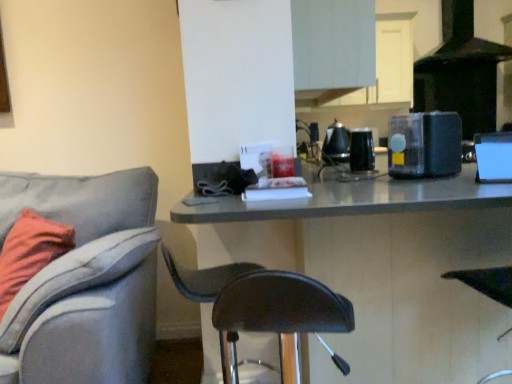
What is the approximate width of black matte exhaust hood at upper right?

black matte exhaust hood at upper right is 53.10 centimeters in width.

Where is `black plastic blender at upper right, which appears as the 2th appliance when viewed from the front`? black plastic blender at upper right, which appears as the 2th appliance when viewed from the front is located at coordinates (424, 145).

From a real-world perspective, is black matte exhaust hood at upper right on black glossy coffee maker at upper center, which ranks as the third appliance in front-to-back order?

Yes, from a real-world perspective, black matte exhaust hood at upper right is over black glossy coffee maker at upper center, which ranks as the third appliance in front-to-back order

Based on their sizes in the image, would you say black matte exhaust hood at upper right is bigger or smaller than black glossy coffee maker at upper center, marked as the 2th appliance in a back-to-front arrangement?

Considering their sizes, black matte exhaust hood at upper right takes up more space than black glossy coffee maker at upper center, marked as the 2th appliance in a back-to-front arrangement.

From the image's perspective, is black matte exhaust hood at upper right located above or below black glossy coffee maker at upper center, which ranks as the third appliance in front-to-back order?

black matte exhaust hood at upper right is above black glossy coffee maker at upper center, which ranks as the third appliance in front-to-back order.

Considering the sizes of objects black matte exhaust hood at upper right and black glossy coffee maker at upper center, marked as the 2th appliance in a back-to-front arrangement, in the image provided, who is thinner, black matte exhaust hood at upper right or black glossy coffee maker at upper center, marked as the 2th appliance in a back-to-front arrangement,?

With smaller width is black glossy coffee maker at upper center, marked as the 2th appliance in a back-to-front arrangement.

From a real-world perspective, between light gray fabric chair at left, arranged as the second chair when viewed from the right, and black glossy kettle at upper center, marked as the 1th appliance in a back-to-front arrangement, who is vertically higher?

black glossy kettle at upper center, marked as the 1th appliance in a back-to-front arrangement.

How different are the orientations of light gray fabric chair at left, which ranks as the 1th chair in left-to-right order, and black glossy kettle at upper center, marked as the 1th appliance in a back-to-front arrangement, in degrees?

light gray fabric chair at left, which ranks as the 1th chair in left-to-right order, and black glossy kettle at upper center, marked as the 1th appliance in a back-to-front arrangement, are facing 86.2 degrees away from each other.

From the image's perspective, is light gray fabric chair at left, which ranks as the 1th chair in left-to-right order, above black glossy kettle at upper center, which is the fourth appliance in front-to-back order?

Incorrect, from the image's perspective, light gray fabric chair at left, which ranks as the 1th chair in left-to-right order, is lower than black glossy kettle at upper center, which is the fourth appliance in front-to-back order.

Considering the sizes of light gray fabric chair at left, which ranks as the 1th chair in left-to-right order, and black glossy kettle at upper center, which is the fourth appliance in front-to-back order, in the image, is light gray fabric chair at left, which ranks as the 1th chair in left-to-right order, wider or thinner than black glossy kettle at upper center, which is the fourth appliance in front-to-back order,?

light gray fabric chair at left, which ranks as the 1th chair in left-to-right order, is wider than black glossy kettle at upper center, which is the fourth appliance in front-to-back order.

Could you tell me if black glossy kettle at upper center, which is the fourth appliance in front-to-back order, is facing black leather chair at center, placed as the second chair when sorted from left to right?

No, black glossy kettle at upper center, which is the fourth appliance in front-to-back order, does not turn towards black leather chair at center, placed as the second chair when sorted from left to right.

Looking at the image, does black glossy kettle at upper center, marked as the 1th appliance in a back-to-front arrangement, seem bigger or smaller compared to black leather chair at center, placed as the second chair when sorted from left to right?

black glossy kettle at upper center, marked as the 1th appliance in a back-to-front arrangement, is smaller than black leather chair at center, placed as the second chair when sorted from left to right.

From the picture: Which point is more forward, (345, 133) or (281, 349)?

The point (281, 349) is in front.

Between black plastic blender at upper right, which appears as the 2th appliance when viewed from the front, and black glossy coffee maker at upper center, which ranks as the third appliance in front-to-back order, which one appears on the left side from the viewer's perspective?

black glossy coffee maker at upper center, which ranks as the third appliance in front-to-back order, is more to the left.

From a real-world perspective, relative to black glossy coffee maker at upper center, marked as the 2th appliance in a back-to-front arrangement, is black plastic blender at upper right, which appears as the 3th appliance when viewed from the back, vertically above or below?

In terms of real-world spatial position, black plastic blender at upper right, which appears as the 3th appliance when viewed from the back, is above black glossy coffee maker at upper center, marked as the 2th appliance in a back-to-front arrangement.

From their relative heights in the image, would you say black plastic blender at upper right, which appears as the 2th appliance when viewed from the front, is taller or shorter than black glossy coffee maker at upper center, which ranks as the third appliance in front-to-back order?

Considering their sizes, black plastic blender at upper right, which appears as the 2th appliance when viewed from the front, has more height than black glossy coffee maker at upper center, which ranks as the third appliance in front-to-back order.

Is point (115, 312) closer or farther from the camera than point (298, 301)?

Point (115, 312) is farther from the camera than point (298, 301).

Considering the relative sizes of light gray fabric chair at left, arranged as the second chair when viewed from the right, and black leather chair at center, marked as the 1th chair in a right-to-left arrangement, in the image provided, is light gray fabric chair at left, arranged as the second chair when viewed from the right, shorter than black leather chair at center, marked as the 1th chair in a right-to-left arrangement,?

In fact, light gray fabric chair at left, arranged as the second chair when viewed from the right, may be taller than black leather chair at center, marked as the 1th chair in a right-to-left arrangement.

Find the location of a particular element. This screenshot has height=384, width=512. chair in front of the black leather chair at center, placed as the second chair when sorted from left to right is located at coordinates (86, 279).

Is light gray fabric chair at left, arranged as the second chair when viewed from the right, aimed at black leather chair at center, placed as the second chair when sorted from left to right?

No, light gray fabric chair at left, arranged as the second chair when viewed from the right, is not turned towards black leather chair at center, placed as the second chair when sorted from left to right.

From a real-world perspective, is light gray fabric chair at left, which ranks as the 1th chair in left-to-right order, physically below black plastic blender at upper right, which appears as the 3th appliance when viewed from the back?

Yes, from a real-world perspective, light gray fabric chair at left, which ranks as the 1th chair in left-to-right order, is beneath black plastic blender at upper right, which appears as the 3th appliance when viewed from the back.

Considering the relative sizes of light gray fabric chair at left, which ranks as the 1th chair in left-to-right order, and black plastic blender at upper right, which appears as the 3th appliance when viewed from the back, in the image provided, is light gray fabric chair at left, which ranks as the 1th chair in left-to-right order, shorter than black plastic blender at upper right, which appears as the 3th appliance when viewed from the back,?

No, light gray fabric chair at left, which ranks as the 1th chair in left-to-right order, is not shorter than black plastic blender at upper right, which appears as the 3th appliance when viewed from the back.

Considering the positions of objects light gray fabric chair at left, which ranks as the 1th chair in left-to-right order, and black plastic blender at upper right, which appears as the 2th appliance when viewed from the front, in the image provided, who is behind, light gray fabric chair at left, which ranks as the 1th chair in left-to-right order, or black plastic blender at upper right, which appears as the 2th appliance when viewed from the front,?

black plastic blender at upper right, which appears as the 2th appliance when viewed from the front, is more distant.

From the image's perspective, relative to black plastic blender at upper right, which appears as the 2th appliance when viewed from the front, is light gray fabric chair at left, which ranks as the 1th chair in left-to-right order, above or below?

From the image's perspective, light gray fabric chair at left, which ranks as the 1th chair in left-to-right order, appears below black plastic blender at upper right, which appears as the 2th appliance when viewed from the front.

Considering the sizes of objects black matte exhaust hood at upper right and light gray fabric chair at left, which ranks as the 1th chair in left-to-right order, in the image provided, who is bigger, black matte exhaust hood at upper right or light gray fabric chair at left, which ranks as the 1th chair in left-to-right order,?

Bigger between the two is light gray fabric chair at left, which ranks as the 1th chair in left-to-right order.

Is black matte exhaust hood at upper right outside of light gray fabric chair at left, which ranks as the 1th chair in left-to-right order?

Indeed, black matte exhaust hood at upper right is completely outside light gray fabric chair at left, which ranks as the 1th chair in left-to-right order.

Based on the photo, is there a large distance between black matte exhaust hood at upper right and light gray fabric chair at left, which ranks as the 1th chair in left-to-right order?

Indeed, black matte exhaust hood at upper right is not near light gray fabric chair at left, which ranks as the 1th chair in left-to-right order.

Image resolution: width=512 pixels, height=384 pixels. I want to click on the 2nd appliance below when counting from the black matte exhaust hood at upper right (from the image's perspective), so (x=362, y=150).

Where is `appliance that is the 3rd object above the light gray fabric chair at left, arranged as the second chair when viewed from the right (from a real-world perspective)`? Image resolution: width=512 pixels, height=384 pixels. appliance that is the 3rd object above the light gray fabric chair at left, arranged as the second chair when viewed from the right (from a real-world perspective) is located at coordinates (336, 143).

Which object lies further to the anchor point black plastic blender at upper right, which appears as the 3th appliance when viewed from the back, black matte exhaust hood at upper right or black glossy coffee maker at upper center, marked as the 2th appliance in a back-to-front arrangement?

black matte exhaust hood at upper right.

Based on the photo, estimate the real-world distances between objects in this image. Which object is closer to light gray fabric chair at left, which ranks as the 1th chair in left-to-right order, matte gray table at center or black glossy coffee maker at upper center, marked as the 2th appliance in a back-to-front arrangement?

matte gray table at center is closer to light gray fabric chair at left, which ranks as the 1th chair in left-to-right order.

When comparing their distances from black glossy coffee maker at upper center, which ranks as the third appliance in front-to-back order, does black leather chair at center, placed as the second chair when sorted from left to right, or blue glossy speaker at right, positioned as the first appliance in front-to-back order, seem closer?

blue glossy speaker at right, positioned as the first appliance in front-to-back order, is closer to black glossy coffee maker at upper center, which ranks as the third appliance in front-to-back order.

Estimate the real-world distances between objects in this image. Which object is further from matte gray table at center, black matte exhaust hood at upper right or black glossy coffee maker at upper center, marked as the 2th appliance in a back-to-front arrangement?

Among the two, black matte exhaust hood at upper right is located further to matte gray table at center.

Considering their positions, is black leather chair at center, placed as the second chair when sorted from left to right, positioned further to black matte exhaust hood at upper right than black glossy coffee maker at upper center, marked as the 2th appliance in a back-to-front arrangement?

black leather chair at center, placed as the second chair when sorted from left to right, is further to black matte exhaust hood at upper right.

Estimate the real-world distances between objects in this image. Which object is closer to light gray fabric chair at left, arranged as the second chair when viewed from the right, black leather chair at center, marked as the 1th chair in a right-to-left arrangement, or blue glossy speaker at right, which is the fourth appliance in back-to-front order?

black leather chair at center, marked as the 1th chair in a right-to-left arrangement, is closer to light gray fabric chair at left, arranged as the second chair when viewed from the right.

Based on their spatial positions, is blue glossy speaker at right, which is the fourth appliance in back-to-front order, or matte gray table at center further from black glossy coffee maker at upper center, marked as the 2th appliance in a back-to-front arrangement?

matte gray table at center.

Based on the photo, considering their positions, is blue glossy speaker at right, which is the fourth appliance in back-to-front order, positioned further to light gray fabric chair at left, arranged as the second chair when viewed from the right, than matte gray table at center?

blue glossy speaker at right, which is the fourth appliance in back-to-front order, is positioned further to the anchor light gray fabric chair at left, arranged as the second chair when viewed from the right.

Where is `chair between blue glossy speaker at right, positioned as the first appliance in front-to-back order, and black glossy kettle at upper center, marked as the 1th appliance in a back-to-front arrangement, along the z-axis`? The width and height of the screenshot is (512, 384). chair between blue glossy speaker at right, positioned as the first appliance in front-to-back order, and black glossy kettle at upper center, marked as the 1th appliance in a back-to-front arrangement, along the z-axis is located at coordinates (260, 303).

You are a GUI agent. You are given a task and a screenshot of the screen. Output one action in this format:
    pyautogui.click(x=<x>, y=<y>)
    Task: Click on the table situated between light gray fabric chair at left, arranged as the second chair when viewed from the right, and black plastic blender at upper right, which appears as the 2th appliance when viewed from the front, from left to right
    The image size is (512, 384).
    Given the screenshot: What is the action you would take?
    pyautogui.click(x=382, y=268)

I want to click on chair between matte gray table at center and black glossy kettle at upper center, marked as the 1th appliance in a back-to-front arrangement, in the front-back direction, so click(260, 303).

What are the coordinates of `chair between matte gray table at center and black matte exhaust hood at upper right along the z-axis` in the screenshot? It's located at (260, 303).